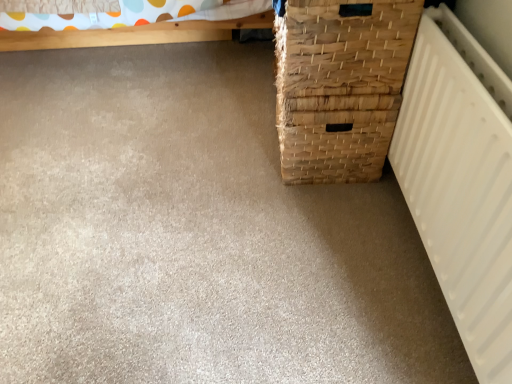
Question: Considering the positions of white matte radiator at right and natural woven basket at right in the image, is white matte radiator at right wider or thinner than natural woven basket at right?

Choices:
 (A) thin
 (B) wide

Answer: (A)

Question: In terms of size, does white matte radiator at right appear bigger or smaller than natural woven basket at right?

Choices:
 (A) small
 (B) big

Answer: (A)

Question: From the image's perspective, is white matte radiator at right located above or below natural woven basket at right?

Choices:
 (A) below
 (B) above

Answer: (A)

Question: Looking at their shapes, would you say natural woven basket at right is wider or thinner than white matte radiator at right?

Choices:
 (A) wide
 (B) thin

Answer: (A)

Question: In the image, is natural woven basket at right on the left side or the right side of white matte radiator at right?

Choices:
 (A) right
 (B) left

Answer: (B)

Question: From the image's perspective, relative to white matte radiator at right, is natural woven basket at right above or below?

Choices:
 (A) above
 (B) below

Answer: (A)

Question: From a real-world perspective, is natural woven basket at right above or below white matte radiator at right?

Choices:
 (A) above
 (B) below

Answer: (B)